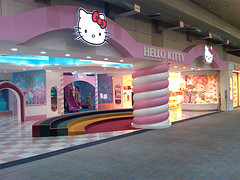
Where is `rug`? This screenshot has height=180, width=240. rug is located at coordinates (166, 144).